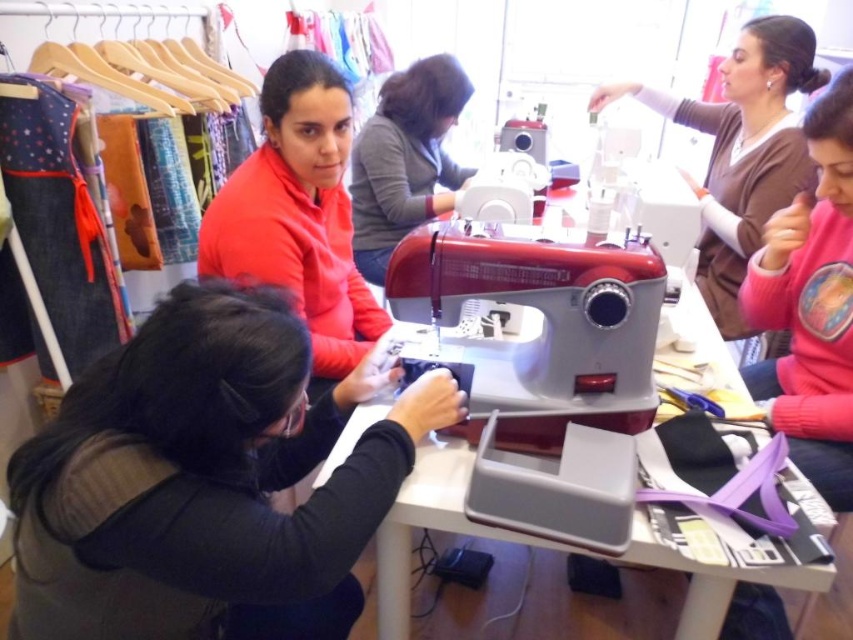
You are a participant in the sewing workshop and need to reach both the black matte fabric at lower left and the pink fleece sweater at upper right. Which object will you need to move closer to first?

The black matte fabric at lower left is closer to the viewer than the pink fleece sweater at upper right, so you should move closer to the black matte fabric at lower left first.

You are a tailor working on the white plastic table at center and need to reach the black matte fabric at lower left. Is the fabric to your left or right side?

The black matte fabric at lower left is to the left of the white plastic table at center, so it is on your left side.

You are a tailor working in the workshop. You need to place the pink fleece sweater at upper right onto the white plastic table at center. What is the minimum distance you need to move it?

The minimum distance you need to move the pink fleece sweater at upper right to place it on the white plastic table at center is 25.23 inches.